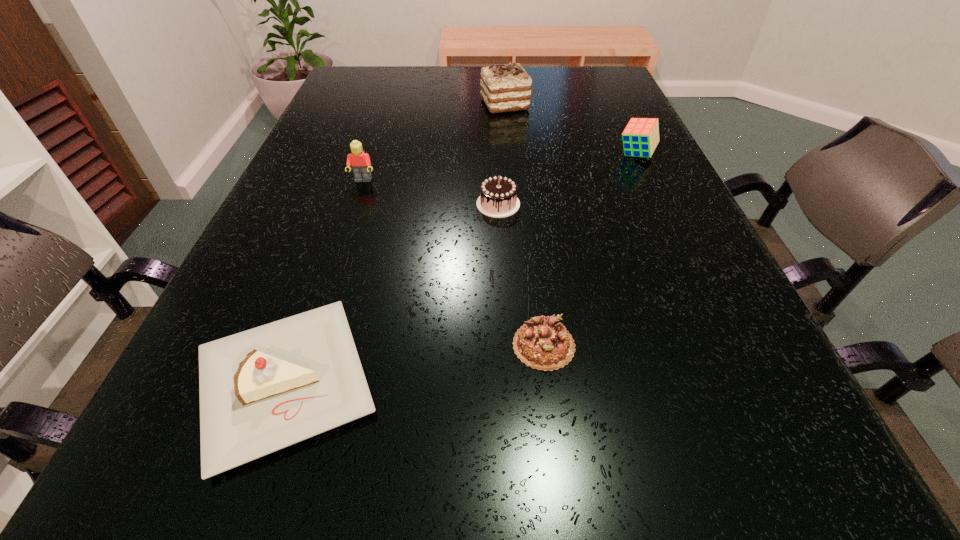
Identify the location of vacant space situated 0.170m on the front of the farthest object. (509, 150).

At what (x,y) coordinates should I click in order to perform the action: click on vacant space located 0.330m on the face of the third farthest object. Please return your answer as a coordinate pair (x, y). The image size is (960, 540). Looking at the image, I should click on (323, 305).

You are a GUI agent. You are given a task and a screenshot of the screen. Output one action in this format:
    pyautogui.click(x=<x>, y=<y>)
    Task: Click on the vacant space located 0.370m on the left of the second farthest object
    The height and width of the screenshot is (540, 960).
    Given the screenshot: What is the action you would take?
    pyautogui.click(x=453, y=154)

This screenshot has height=540, width=960. Find the location of `blank space located on the back of the third nearest object`. blank space located on the back of the third nearest object is located at coordinates (494, 122).

You are a GUI agent. You are given a task and a screenshot of the screen. Output one action in this format:
    pyautogui.click(x=<x>, y=<y>)
    Task: Click on the free spot located on the back of the cake
    
    Given the screenshot: What is the action you would take?
    pyautogui.click(x=358, y=173)

I want to click on free spot located on the back of the shortest chocolate cake, so click(535, 269).

Where is `object located at the far edge`? Image resolution: width=960 pixels, height=540 pixels. object located at the far edge is located at coordinates (504, 87).

Image resolution: width=960 pixels, height=540 pixels. What are the coordinates of `Lego that is at the left edge` in the screenshot? It's located at (360, 161).

In order to click on cake that is at the left edge in this screenshot , I will do `click(261, 390)`.

Find the location of a particular element. This screenshot has height=540, width=960. object at the right edge is located at coordinates (640, 137).